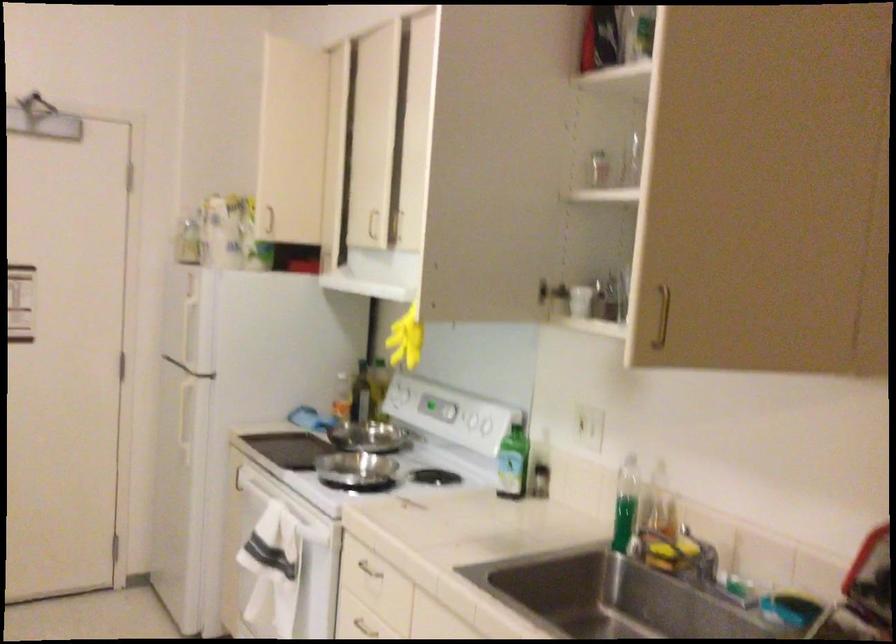
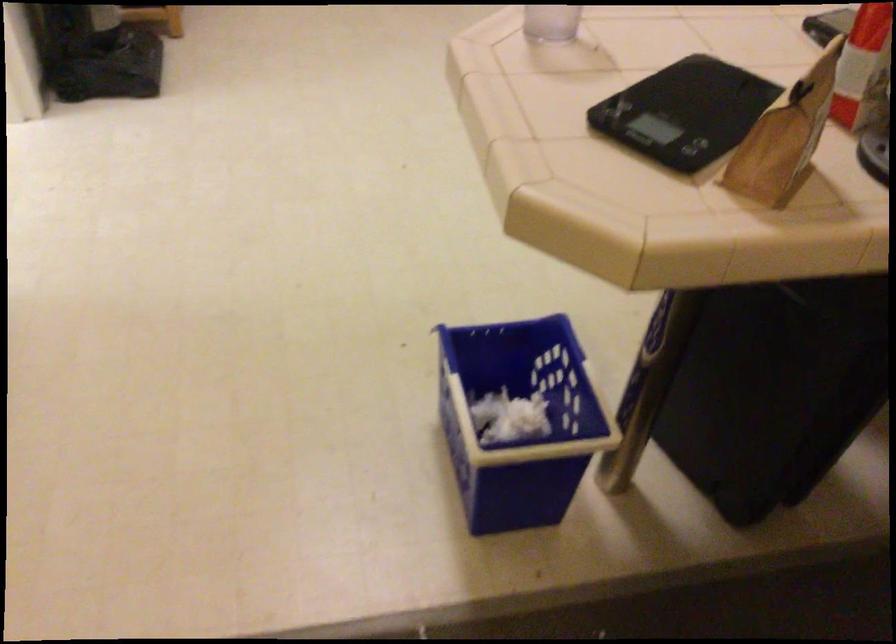
Based on the continuous images, in which direction is the camera rotating?

The rotation direction of the camera is left-down.